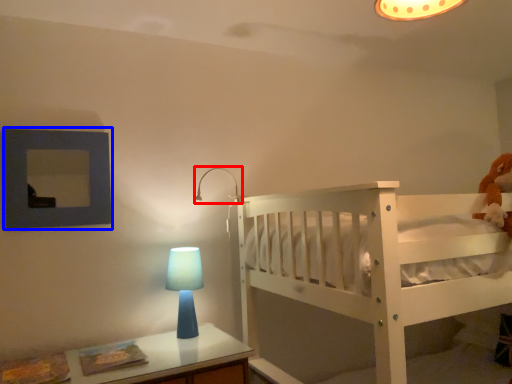
Question: Which object is further to the camera taking this photo, lamp (highlighted by a red box) or picture frame (highlighted by a blue box)?

Choices:
 (A) lamp
 (B) picture frame

Answer: (A)